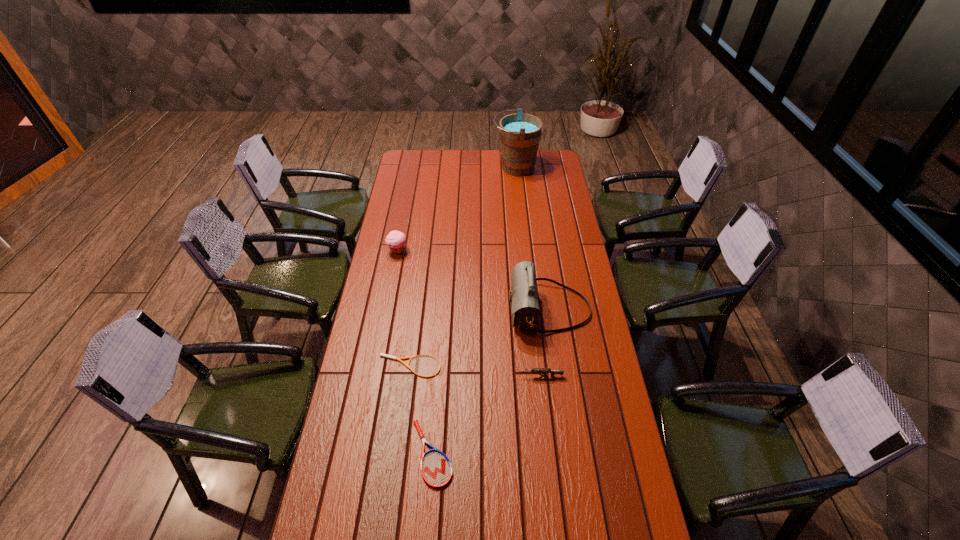
You are a GUI agent. You are given a task and a screenshot of the screen. Output one action in this format:
    pyautogui.click(x=<x>, y=<y>)
    Task: Click on the cupcake that is at the left edge
    The image size is (960, 540).
    Given the screenshot: What is the action you would take?
    pyautogui.click(x=395, y=240)

The image size is (960, 540). I want to click on tennis racket at the left edge, so click(x=381, y=354).

At what (x,y) coordinates should I click in order to perform the action: click on wine bucket that is at the right edge. Please return your answer as a coordinate pair (x, y). The height and width of the screenshot is (540, 960). Looking at the image, I should click on (519, 133).

In order to click on shoulder bag located in the right edge section of the desktop in this screenshot , I will do 524,300.

You are a GUI agent. You are given a task and a screenshot of the screen. Output one action in this format:
    pyautogui.click(x=<x>, y=<y>)
    Task: Click on the object situated at the far right corner
    This screenshot has width=960, height=540.
    Given the screenshot: What is the action you would take?
    pyautogui.click(x=519, y=133)

You are a GUI agent. You are given a task and a screenshot of the screen. Output one action in this format:
    pyautogui.click(x=<x>, y=<y>)
    Task: Click on the vacant space at the far edge of the desktop
    
    Given the screenshot: What is the action you would take?
    pyautogui.click(x=462, y=160)

Locate an element on the screen. free spot at the left edge of the desktop is located at coordinates (379, 393).

Identify the location of free space at the right edge. The image size is (960, 540). (558, 244).

Locate an element on the screen. This screenshot has width=960, height=540. blank area at the far left corner is located at coordinates (397, 170).

I want to click on vacant space that is in between the nearest object and the tallest object, so click(x=473, y=310).